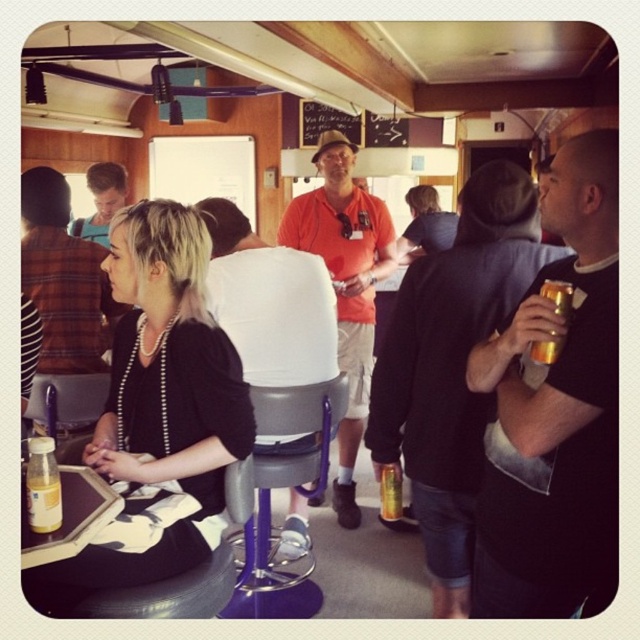
Which of these two, metallic gray bar stool at center or gold metallic can at center, stands taller?

With more height is metallic gray bar stool at center.

Measure the distance between point (273,598) and camera.

They are 2.47 meters apart.

Where is `metallic gray bar stool at center`? metallic gray bar stool at center is located at coordinates (291, 488).

What do you see at coordinates (554, 410) in the screenshot?
I see `black fabric shirt at right` at bounding box center [554, 410].

Is point (560, 156) less distant than point (314, 611)?

Yes, it is.

Where is `black fabric shirt at right`? black fabric shirt at right is located at coordinates tap(554, 410).

You are a GUI agent. You are given a task and a screenshot of the screen. Output one action in this format:
    pyautogui.click(x=<x>, y=<y>)
    Task: Click on the black fabric shirt at right
    The image size is (640, 640).
    Given the screenshot: What is the action you would take?
    pyautogui.click(x=554, y=410)

Which is above, orange t-shirt at center or orange cotton shirt at center?

Positioned higher is orange t-shirt at center.

Can you confirm if orange t-shirt at center is positioned below orange cotton shirt at center?

Incorrect, orange t-shirt at center is not positioned below orange cotton shirt at center.

Is point (308, 317) closer to viewer compared to point (385, 248)?

Yes, point (308, 317) is in front of point (385, 248).

Where is `orange t-shirt at center`? Image resolution: width=640 pixels, height=640 pixels. orange t-shirt at center is located at coordinates (269, 301).